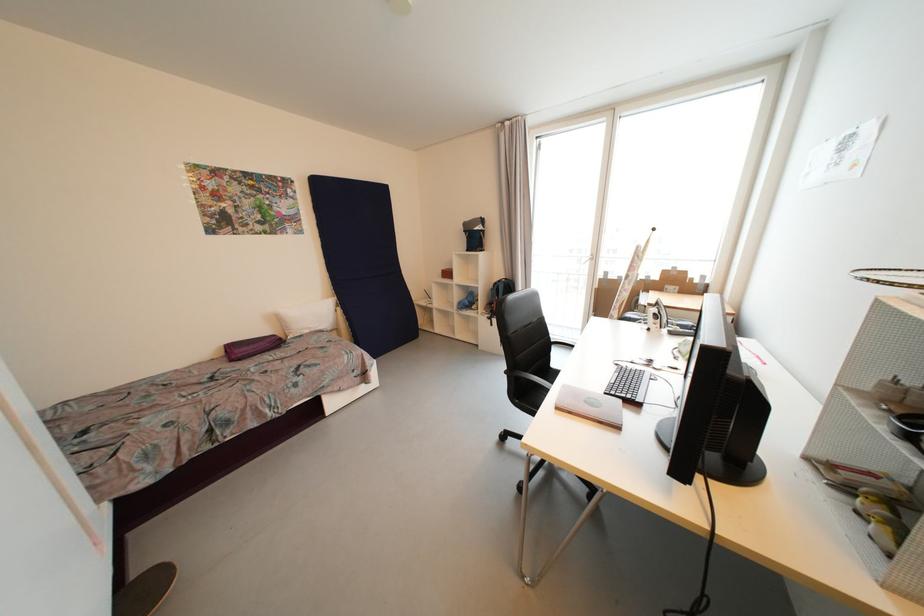
Find the location of a particular element. The height and width of the screenshot is (616, 924). blue foldable mattress is located at coordinates (363, 261).